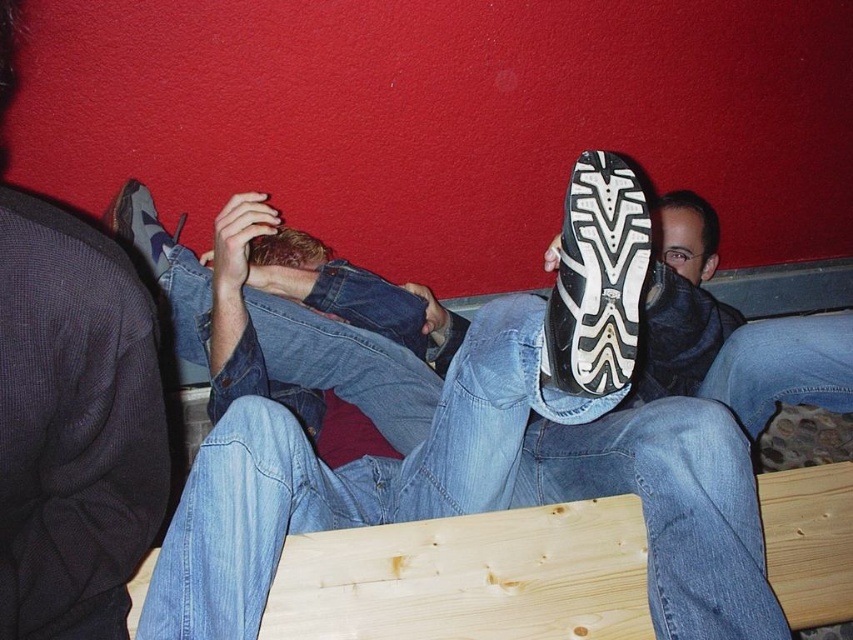
You are a photographer setting up a shoot in this scene. You need to place a small prop between the matte black shoe at upper center and the black rubber shoe at center. Considering their sizes, which shoe should the prop be closer to to ensure it doesn

The matte black shoe at upper center is wider than the black rubber shoe at center. To place the prop between them, it should be closer to the black rubber shoe at center to account for the size difference.

You are a photographer setting up for a group photo. You notice the matte black shoe at upper center and the black rubber shoe at center in the scene. Which shoe is positioned lower in the image?

The matte black shoe at upper center is below the black rubber shoe at center, so it is positioned lower in the image.